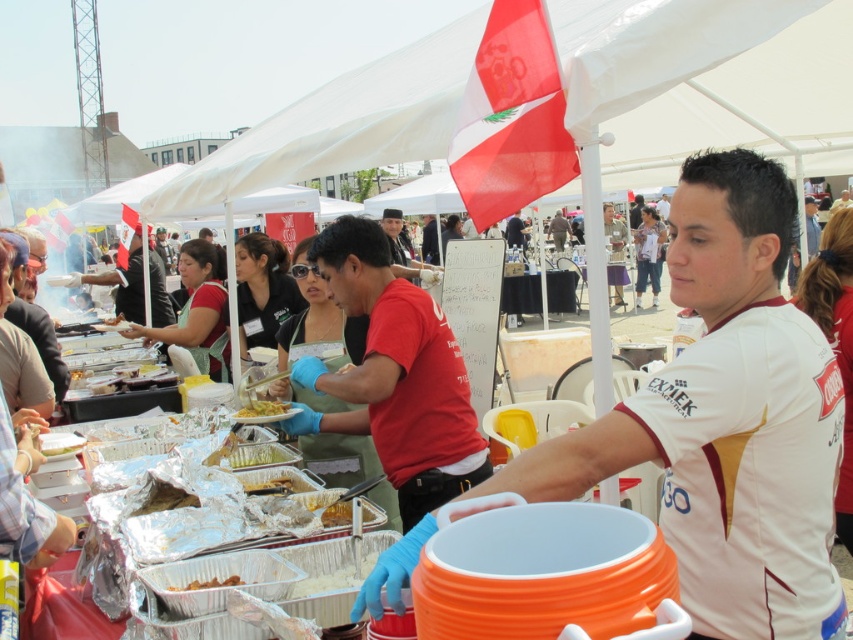
Is green matte food at center taller than yellow matte food at center?

Yes, green matte food at center is taller than yellow matte food at center.

Between point (245, 445) and point (370, 516), which one is positioned behind?

Positioned behind is point (245, 445).

Image resolution: width=853 pixels, height=640 pixels. I want to click on green matte food at center, so click(x=260, y=456).

Is green matte food at center positioned behind yellow matte pasta at center?

No, green matte food at center is closer to the viewer.

Measure the distance from green matte food at center to yellow matte pasta at center.

A distance of 15.81 centimeters exists between green matte food at center and yellow matte pasta at center.

Find the location of a particular element. The width and height of the screenshot is (853, 640). green matte food at center is located at coordinates (260, 456).

Which is more to the right, yellow matte pasta at center or brown matte food at center?

Positioned to the right is brown matte food at center.

Can you confirm if yellow matte pasta at center is shorter than brown matte food at center?

Incorrect, yellow matte pasta at center's height does not fall short of brown matte food at center's.

Which is in front, point (260, 416) or point (196, 586)?

Point (196, 586)

Locate an element on the screen. The image size is (853, 640). yellow matte pasta at center is located at coordinates pos(262,410).